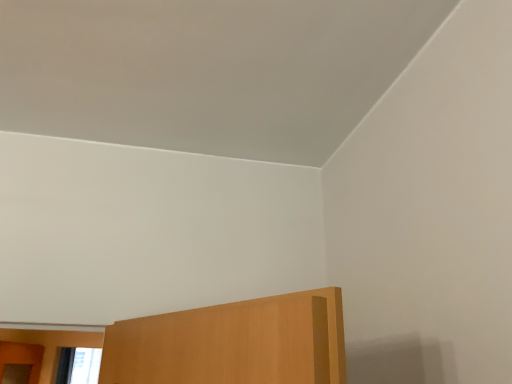
The width and height of the screenshot is (512, 384). Identify the location of transparent glass window at lower left. (78, 365).

Looking at this image, what is the approximate height of transparent glass window at lower left?

It is 29.90 inches.

Describe the element at coordinates (78, 365) in the screenshot. I see `transparent glass window at lower left` at that location.

Measure the distance between transparent glass window at lower left and camera.

transparent glass window at lower left is 3.61 meters away from camera.

Identify the location of transparent glass window at lower left. (78, 365).